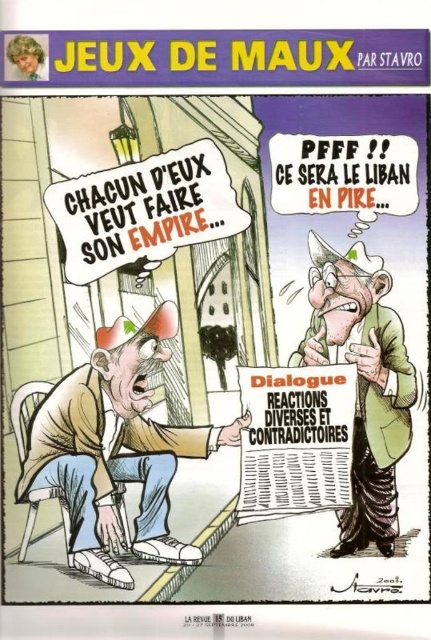
Can you confirm if brown leather jacket at lower left is positioned to the right of white paper newspaper at center?

No, brown leather jacket at lower left is not to the right of white paper newspaper at center.

Who is positioned more to the left, brown leather jacket at lower left or white paper newspaper at center?

brown leather jacket at lower left

Locate an element on the screen. brown leather jacket at lower left is located at coordinates (112, 451).

Does point (346, 474) come behind point (212, 541)?

Yes, point (346, 474) is behind point (212, 541).

This screenshot has width=431, height=640. Describe the element at coordinates (296, 440) in the screenshot. I see `white paper newspaper at center` at that location.

Is point (337, 413) more distant than point (175, 584)?

Yes, it is behind point (175, 584).

Locate an element on the screen. The width and height of the screenshot is (431, 640). white paper newspaper at center is located at coordinates (296, 440).

Is brown leather jacket at lower left below white canvas shoes at lower center?

Actually, brown leather jacket at lower left is above white canvas shoes at lower center.

Between point (71, 554) and point (178, 588), which one is positioned behind?

Positioned behind is point (178, 588).

Locate an element on the screen. The height and width of the screenshot is (640, 431). brown leather jacket at lower left is located at coordinates (112, 451).